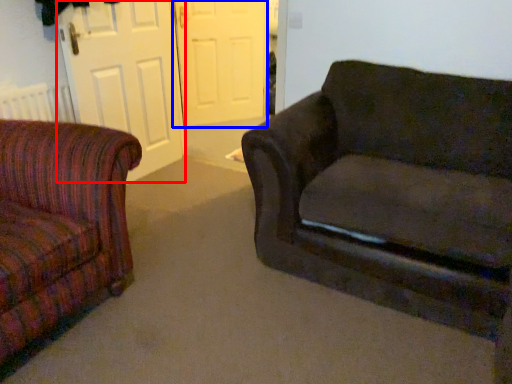
Question: Among these objects, which one is nearest to the camera, screen door (highlighted by a red box) or screen door (highlighted by a blue box)?

Choices:
 (A) screen door
 (B) screen door

Answer: (A)